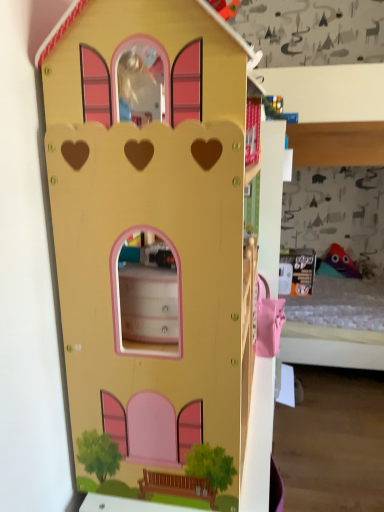
Question: Which direction should I rotate to look at matte yellow castle at center, which is the 1th toy from front to back?

Choices:
 (A) right
 (B) left

Answer: (B)

Question: Considering the relative positions of multicolored fabric toy at right, placed as the second toy when sorted from front to back, and matte yellow castle at center, the first toy from the left, in the image provided, is multicolored fabric toy at right, placed as the second toy when sorted from front to back, behind matte yellow castle at center, the first toy from the left,?

Choices:
 (A) no
 (B) yes

Answer: (B)

Question: Considering the relative sizes of multicolored fabric toy at right, positioned as the 2th toy in left-to-right order, and matte yellow castle at center, which is the 1th toy from front to back, in the image provided, is multicolored fabric toy at right, positioned as the 2th toy in left-to-right order, shorter than matte yellow castle at center, which is the 1th toy from front to back,?

Choices:
 (A) yes
 (B) no

Answer: (A)

Question: From a real-world perspective, does multicolored fabric toy at right, positioned as the first toy in back-to-front order, sit lower than matte yellow castle at center, which is the 1th toy from front to back?

Choices:
 (A) yes
 (B) no

Answer: (A)

Question: Is multicolored fabric toy at right, placed as the second toy when sorted from front to back, thinner than matte yellow castle at center, the 2th toy viewed from the back?

Choices:
 (A) no
 (B) yes

Answer: (B)

Question: Is multicolored fabric toy at right, placed as the second toy when sorted from front to back, outside matte yellow castle at center, the first toy from the left?

Choices:
 (A) no
 (B) yes

Answer: (B)

Question: Does multicolored fabric toy at right, placed as the second toy when sorted from front to back, have a greater width compared to matte yellow castle at center, which is counted as the 2th toy, starting from the right?

Choices:
 (A) yes
 (B) no

Answer: (B)

Question: Considering the relative sizes of matte yellow castle at center, which is counted as the 2th toy, starting from the right, and multicolored fabric toy at right, positioned as the 2th toy in left-to-right order, in the image provided, is matte yellow castle at center, which is counted as the 2th toy, starting from the right, taller than multicolored fabric toy at right, positioned as the 2th toy in left-to-right order,?

Choices:
 (A) yes
 (B) no

Answer: (A)

Question: Are matte yellow castle at center, the first toy from the left, and multicolored fabric toy at right, placed as the second toy when sorted from front to back, located far from each other?

Choices:
 (A) yes
 (B) no

Answer: (A)

Question: Is matte yellow castle at center, the 2th toy viewed from the back, completely or partially outside of multicolored fabric toy at right, positioned as the first toy in back-to-front order?

Choices:
 (A) yes
 (B) no

Answer: (A)

Question: Is matte yellow castle at center, the 2th toy viewed from the back, oriented away from multicolored fabric toy at right, positioned as the first toy in back-to-front order?

Choices:
 (A) yes
 (B) no

Answer: (B)

Question: Can you confirm if matte yellow castle at center, which is the 1th toy from front to back, is shorter than multicolored fabric toy at right, placed as the second toy when sorted from front to back?

Choices:
 (A) no
 (B) yes

Answer: (A)

Question: Is matte yellow castle at center, the first toy from the left, oriented towards multicolored fabric toy at right, positioned as the first toy in back-to-front order?

Choices:
 (A) yes
 (B) no

Answer: (B)

Question: From their relative heights in the image, would you say multicolored fabric toy at right, positioned as the first toy in back-to-front order, is taller or shorter than matte yellow castle at center, the first toy from the left?

Choices:
 (A) tall
 (B) short

Answer: (B)